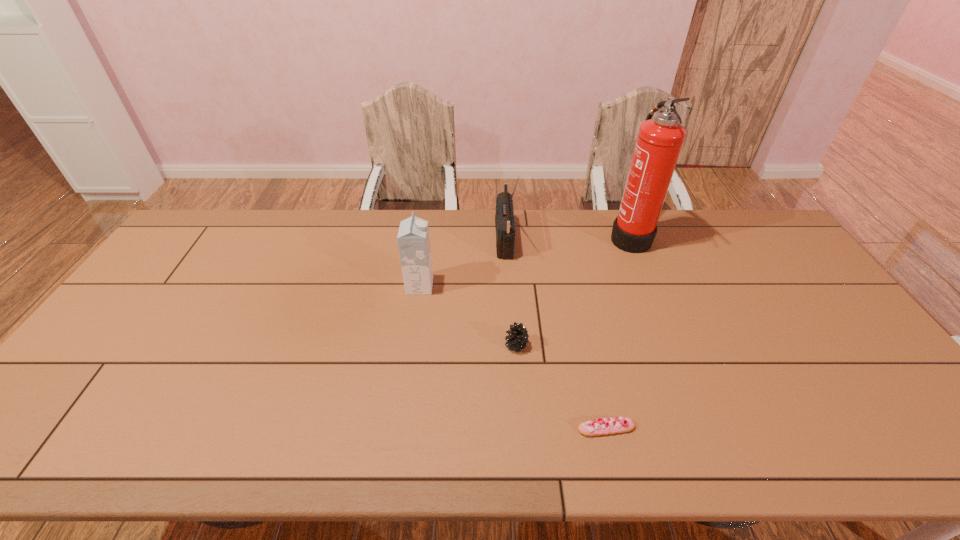
Locate an element on the screen. The height and width of the screenshot is (540, 960). free space that satisfies the following two spatial constraints: 1. on the front-facing side of the tallest object; 2. on the front side of the second object from right to left is located at coordinates (707, 428).

At what (x,y) coordinates should I click in order to perform the action: click on vacant space that satisfies the following two spatial constraints: 1. on the front-facing side of the radio receiver; 2. on the left side of the eclair. Please return your answer as a coordinate pair (x, y). Looking at the image, I should click on (516, 428).

Where is `free region that satisfies the following two spatial constraints: 1. on the back side of the fourth tallest object; 2. on the front label of the third nearest object`? This screenshot has width=960, height=540. free region that satisfies the following two spatial constraints: 1. on the back side of the fourth tallest object; 2. on the front label of the third nearest object is located at coordinates (512, 286).

Find the location of `free location that satisfies the following two spatial constraints: 1. on the front label of the shortest object; 2. on the right side of the leftmost object`. free location that satisfies the following two spatial constraints: 1. on the front label of the shortest object; 2. on the right side of the leftmost object is located at coordinates (399, 428).

Identify the location of vacant space that satisfies the following two spatial constraints: 1. on the front label of the third nearest object; 2. on the left side of the eclair. (399, 428).